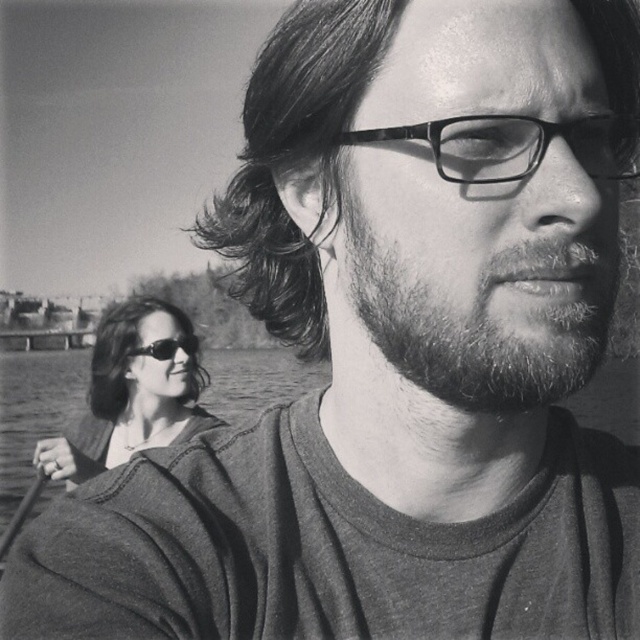
Question: Among these objects, which one is farthest from the camera?

Choices:
 (A) dark brown textured hair at center
 (B) dark shiny hair at lower left

Answer: (B)

Question: Is dark brown textured hair at center thinner than bearded at center?

Choices:
 (A) yes
 (B) no

Answer: (B)

Question: Is bearded at center to the right of dark shiny hair at lower left from the viewer's perspective?

Choices:
 (A) yes
 (B) no

Answer: (A)

Question: Can you confirm if dark brown textured hair at center is wider than dark shiny hair at lower left?

Choices:
 (A) no
 (B) yes

Answer: (B)

Question: Which point is closer to the camera?

Choices:
 (A) (99, 364)
 (B) (273, 52)
 (C) (536, 403)

Answer: (C)

Question: Which of these objects is positioned farthest from the bearded at center?

Choices:
 (A) dark brown textured hair at center
 (B) dark shiny hair at lower left

Answer: (B)